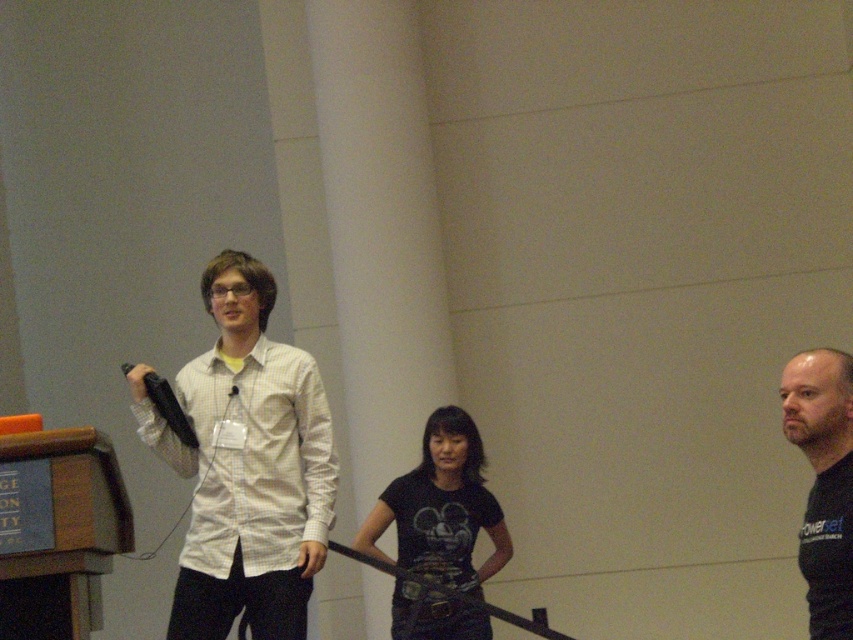
Is black matte shirt at center further to camera compared to black matte t-shirt at center?

No, black matte shirt at center is closer to the viewer.

In the scene shown: Between black matte shirt at center and black matte t-shirt at center, which one has less height?

Standing shorter between the two is black matte t-shirt at center.

The width and height of the screenshot is (853, 640). In order to click on black matte shirt at center in this screenshot , I will do [x=247, y=465].

Does black matte shirt at center have a smaller size compared to black matte shirt at right?

No.

Who is positioned more to the left, black matte shirt at center or black matte shirt at right?

black matte shirt at center is more to the left.

Does point (242, 515) come farther from viewer compared to point (831, 573)?

Yes, it is behind point (831, 573).

I want to click on black matte shirt at center, so click(x=247, y=465).

Between black matte t-shirt at center and black matte shirt at right, which one is positioned higher?

black matte shirt at right is above.

Between black matte t-shirt at center and black matte shirt at right, which one is positioned lower?

black matte t-shirt at center

You are a GUI agent. You are given a task and a screenshot of the screen. Output one action in this format:
    pyautogui.click(x=<x>, y=<y>)
    Task: Click on the black matte t-shirt at center
    
    Given the screenshot: What is the action you would take?
    pyautogui.click(x=440, y=508)